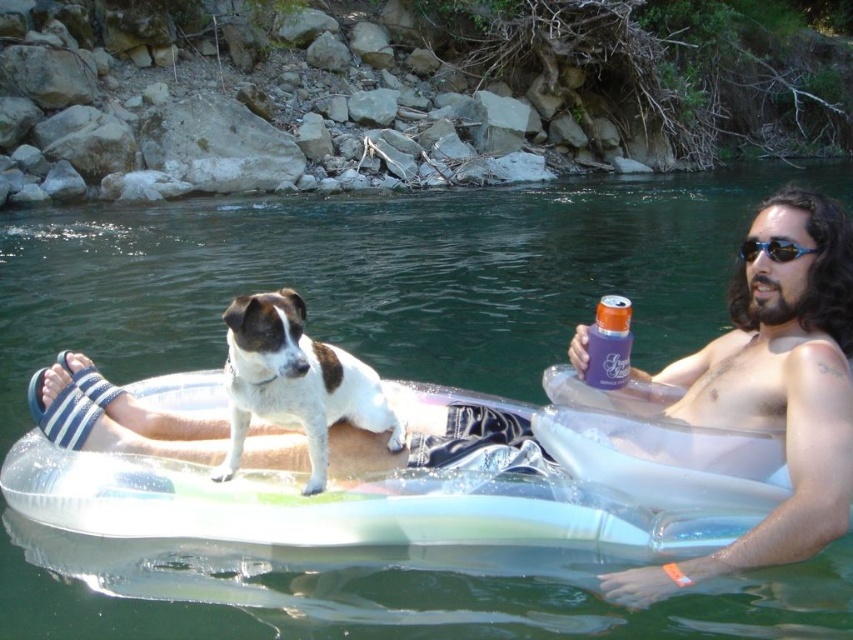
Question: Where is white fur dog at center located in relation to blue plastic sunglasses at upper right in the image?

Choices:
 (A) below
 (B) above

Answer: (A)

Question: Which point appears farthest from the camera in this image?

Choices:
 (A) (343, 392)
 (B) (788, 253)

Answer: (A)

Question: Is white fur dog at center positioned at the back of blue plastic sunglasses at upper right?

Choices:
 (A) no
 (B) yes

Answer: (A)

Question: Which point appears closest to the camera in this image?

Choices:
 (A) (770, 241)
 (B) (363, 400)

Answer: (A)

Question: Among these objects, which one is nearest to the camera?

Choices:
 (A) blue plastic sunglasses at upper right
 (B) white fur dog at center

Answer: (B)

Question: From the image, what is the correct spatial relationship of white fur dog at center in relation to blue plastic sunglasses at upper right?

Choices:
 (A) right
 (B) left

Answer: (B)